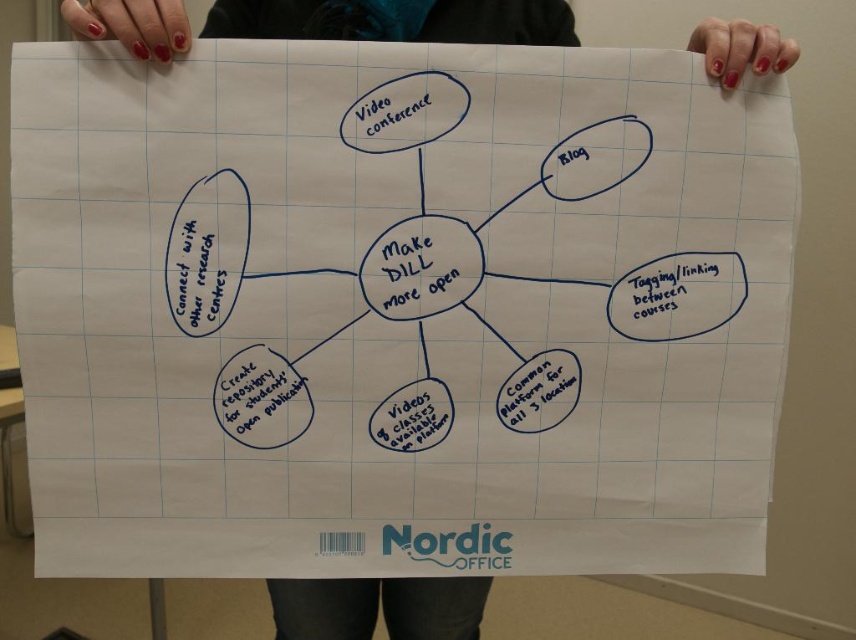
What is the content of the handwritten text at the point marked by coordinates (676, 292)?

The content of the handwritten text at point (676, 292) is the idea of creating a repository for students Open publication.

You are a project manager reviewing the brainstorming diagram. You need to determine which text element has a greater width between the black handwritten text at upper right and the matte blue text at upper center. Which one is wider?

The black handwritten text at upper right is wider than the matte blue text at upper center according to the description.

What is located at the coordinates point (200, 273)?

The black handwritten text at upper left is located at point (200, 273).